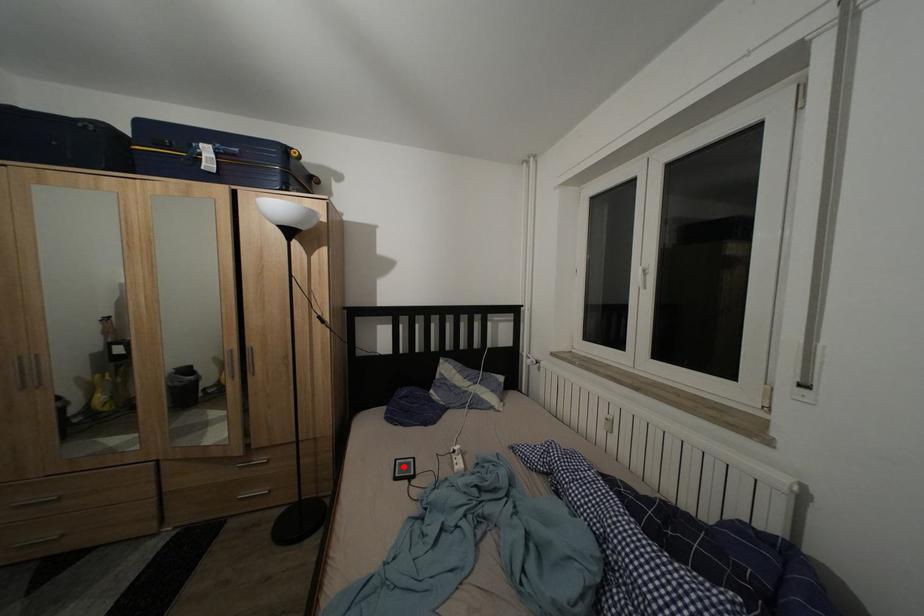
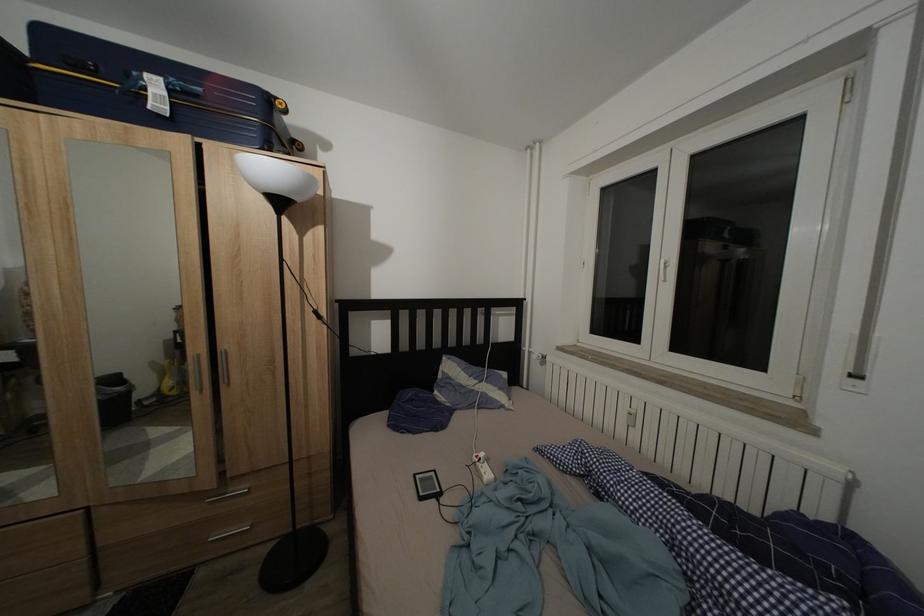
The point at the highlighted location is marked in the first image. Where is the corresponding point in the second image?

(422, 482)